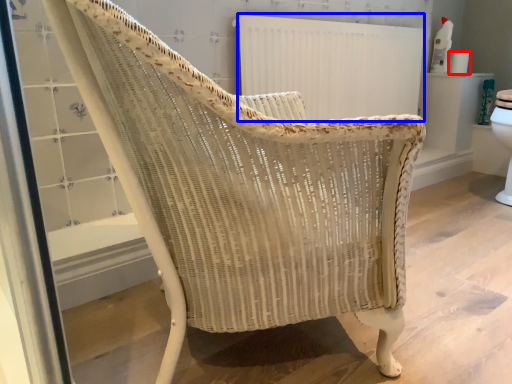
Question: Which of the following is the closest to the observer, toilet paper (highlighted by a red box) or radiator (highlighted by a blue box)?

Choices:
 (A) toilet paper
 (B) radiator

Answer: (B)